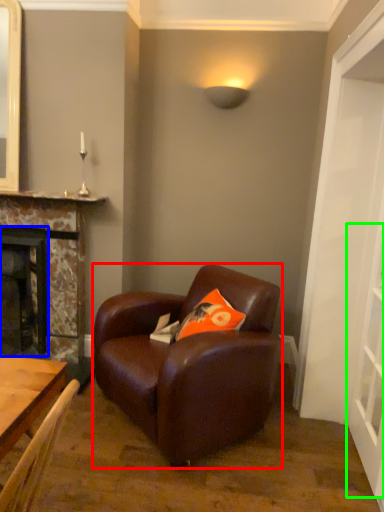
Question: Considering the real-world distances, which object is closest to chair (highlighted by a red box)? fireplace (highlighted by a blue box) or glass door (highlighted by a green box).

Choices:
 (A) fireplace
 (B) glass door

Answer: (B)